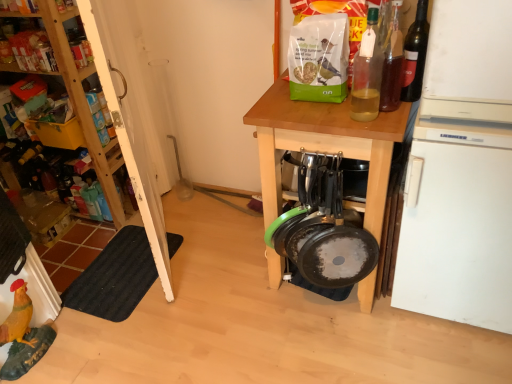
Question: In terms of width, does wooden shelves at left look wider or thinner when compared to translucent glass bottle at upper right, the 3th bottle in the right-to-left sequence?

Choices:
 (A) thin
 (B) wide

Answer: (B)

Question: Choose the correct answer: Is wooden shelves at left inside translucent glass bottle at upper right, the 1th bottle viewed from the left, or outside it?

Choices:
 (A) outside
 (B) inside

Answer: (A)

Question: Estimate the real-world distances between objects in this image. Which object is closer to the wooden table at center?

Choices:
 (A) translucent glass bottle at upper right, the 3th bottle in the right-to-left sequence
 (B) black rubber mat at lower left
 (C) white matte refrigerator at right
 (D) translucent glass bottle at upper right, marked as the second bottle in a right-to-left arrangement
 (E) wooden shelves at upper left

Answer: (A)

Question: Which object is positioned farthest from the translucent glass bottle at upper right, the 3th bottle in the right-to-left sequence?

Choices:
 (A) wooden table at center
 (B) wooden shelves at left
 (C) black rubber mat at lower left
 (D) wooden shelves at upper left
 (E) dark glass bottle at upper right, the 1th bottle in the right-to-left sequence

Answer: (D)